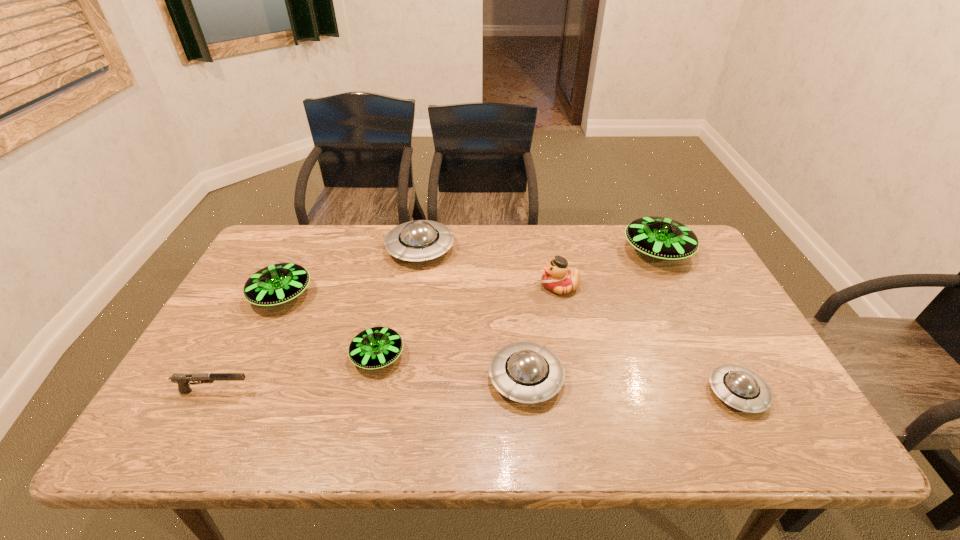
Locate an element on the screen. the rightmost green saucer is located at coordinates (661, 238).

The height and width of the screenshot is (540, 960). I want to click on the farthest green saucer, so click(x=661, y=238).

This screenshot has width=960, height=540. I want to click on red duck, so click(557, 278).

The width and height of the screenshot is (960, 540). In order to click on the farthest gray saucer in this screenshot , I will do `click(419, 240)`.

This screenshot has height=540, width=960. I want to click on the biggest gray saucer, so click(x=419, y=240).

Identify the location of the second smallest green saucer. (276, 284).

The height and width of the screenshot is (540, 960). Identify the location of the leftmost green saucer. (276, 284).

Identify the location of the second gray saucer from left to right. (526, 372).

The width and height of the screenshot is (960, 540). I want to click on the third saucer from right to left, so click(526, 372).

This screenshot has width=960, height=540. What are the coordinates of `the smallest green saucer` in the screenshot? It's located at point(377,347).